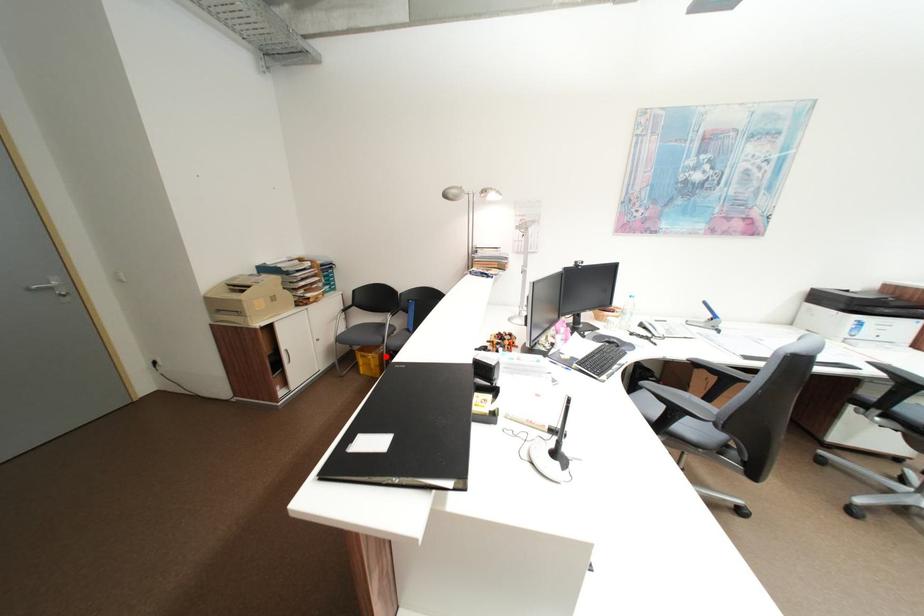
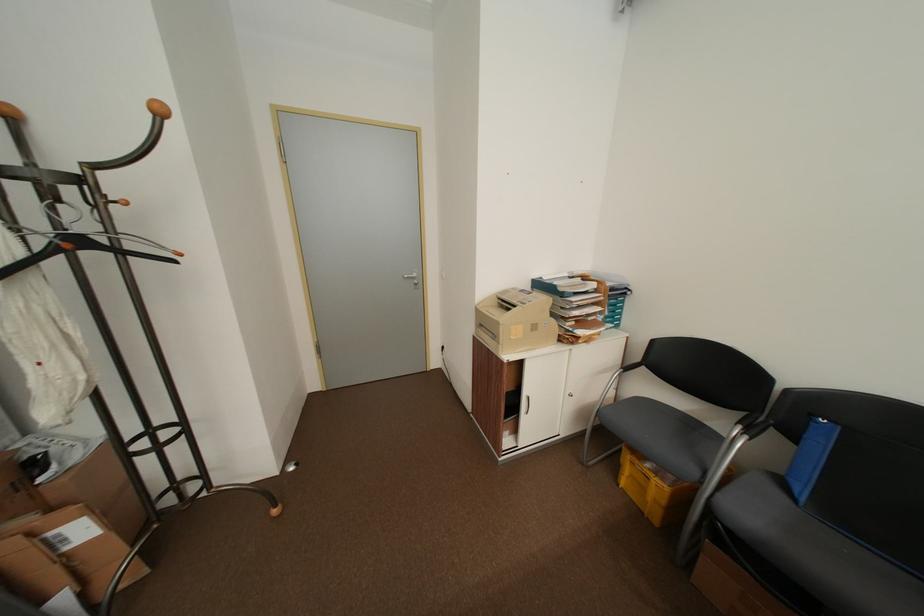
Question: I am providing you with two images of the same scene from different viewpoints. Given a red point in image1, look at the same physical point in image2. Is it:

Choices:
 (A) Closer to the viewpoint
 (B) Farther from the viewpoint

Answer: (A)